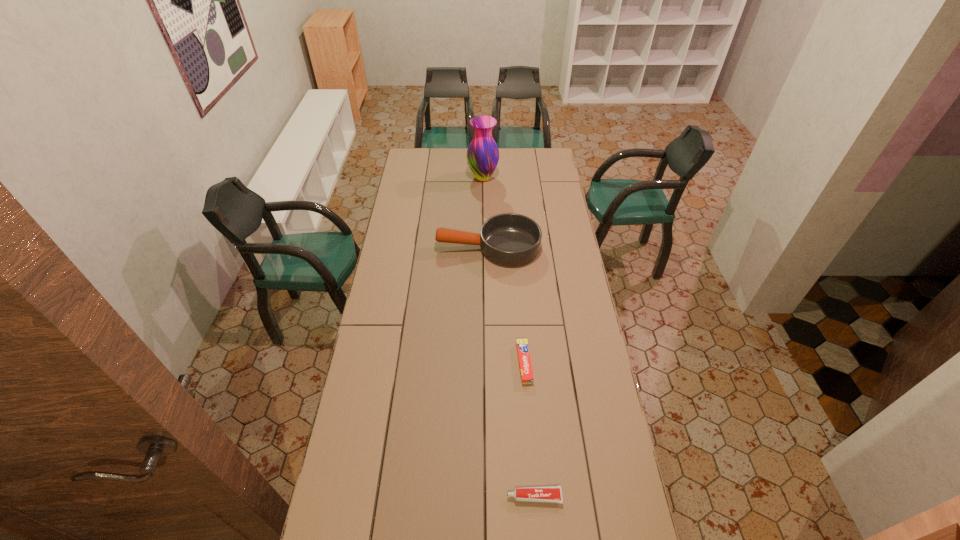
Where is `vacant space located 0.370m at the nozzle of the nearer toothpaste`? The height and width of the screenshot is (540, 960). vacant space located 0.370m at the nozzle of the nearer toothpaste is located at coordinates (387, 496).

Locate an element on the screen. This screenshot has height=540, width=960. free spot located at the nozzle of the nearer toothpaste is located at coordinates (x=406, y=496).

Locate an element on the screen. free space located 0.240m at the nozzle of the nearer toothpaste is located at coordinates (429, 496).

The height and width of the screenshot is (540, 960). I want to click on free space located on the left of the farther toothpaste, so (x=452, y=363).

Where is `object present at the far edge`? The image size is (960, 540). object present at the far edge is located at coordinates (482, 154).

Where is `free space at the left edge of the desktop`? The image size is (960, 540). free space at the left edge of the desktop is located at coordinates (403, 264).

The height and width of the screenshot is (540, 960). In order to click on free space at the right edge in this screenshot , I will do `click(606, 416)`.

At what (x,y) coordinates should I click in order to perform the action: click on vacant space at the far right corner of the desktop. Please return your answer as a coordinate pair (x, y). The height and width of the screenshot is (540, 960). Looking at the image, I should click on point(545,161).

Find the location of a particular element. This screenshot has width=960, height=540. free space between the farther toothpaste and the tallest object is located at coordinates (503, 271).

Image resolution: width=960 pixels, height=540 pixels. Find the location of `free space between the farther toothpaste and the farthest object`. free space between the farther toothpaste and the farthest object is located at coordinates tap(503, 271).